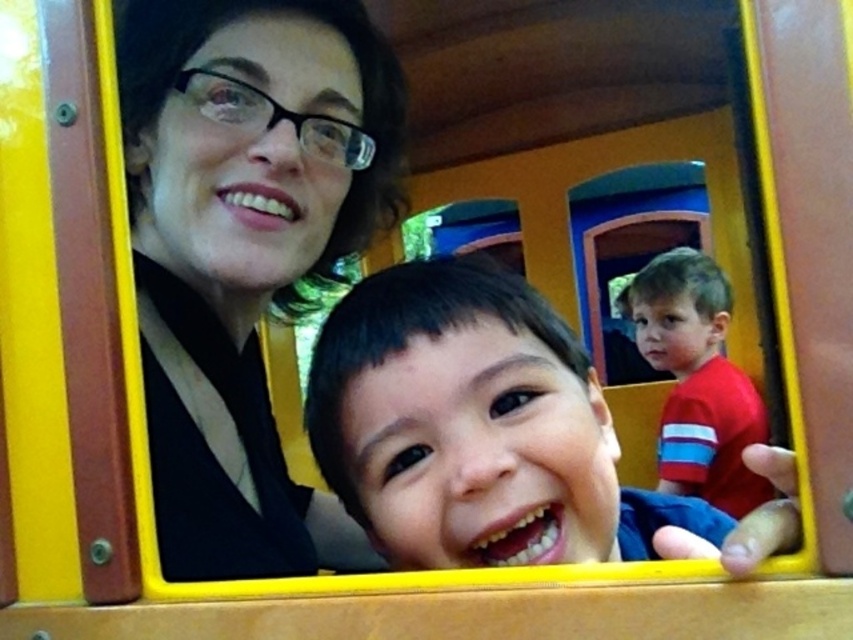
Question: Which point appears closest to the camera in this image?

Choices:
 (A) (170, 468)
 (B) (741, 428)

Answer: (A)

Question: Does smooth skin face at center lie behind red smooth shirt at right?

Choices:
 (A) yes
 (B) no

Answer: (B)

Question: Which object appears closest to the camera in this image?

Choices:
 (A) matte black hair at upper left
 (B) smooth skin face at center
 (C) red smooth shirt at right

Answer: (B)

Question: Does matte black hair at upper left have a greater width compared to red smooth shirt at right?

Choices:
 (A) yes
 (B) no

Answer: (B)

Question: Does matte black hair at upper left have a greater width compared to smooth skin face at center?

Choices:
 (A) yes
 (B) no

Answer: (B)

Question: Which object appears closest to the camera in this image?

Choices:
 (A) red smooth shirt at right
 (B) smooth skin face at center
 (C) matte black hair at upper left

Answer: (B)